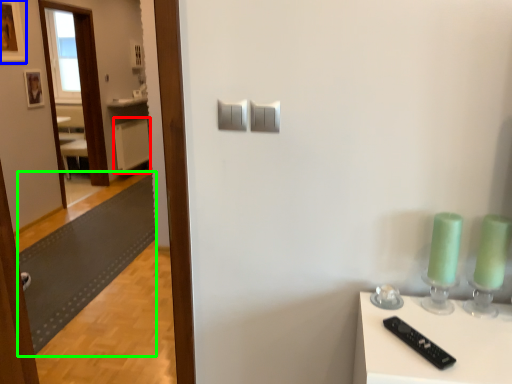
Question: Based on their relative distances, which object is nearer to radiator (highlighted by a red box)? Choose from picture frame (highlighted by a blue box) and mat (highlighted by a green box).

Choices:
 (A) picture frame
 (B) mat

Answer: (B)